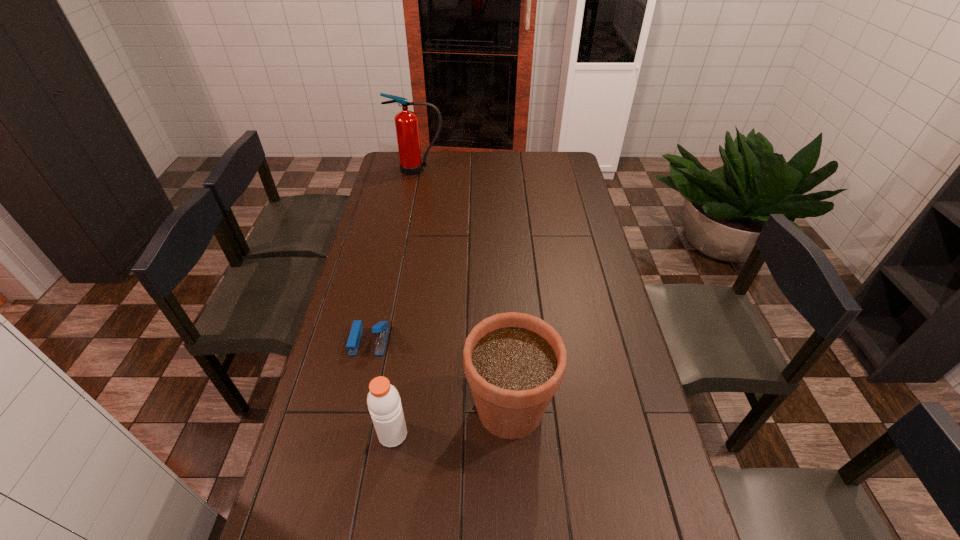
The image size is (960, 540). I want to click on vacant space that's between the second farthest object and the rightmost object, so click(440, 375).

Locate an element on the screen. The height and width of the screenshot is (540, 960). free spot between the shaker and the farthest object is located at coordinates (405, 302).

You are a GUI agent. You are given a task and a screenshot of the screen. Output one action in this format:
    pyautogui.click(x=<x>, y=<y>)
    Task: Click on the free spot between the stapler and the farthest object
    
    Given the screenshot: What is the action you would take?
    pyautogui.click(x=394, y=255)

Image resolution: width=960 pixels, height=540 pixels. What are the coordinates of `vacant point located between the flowerpot and the fire extinguisher` in the screenshot? It's located at (464, 289).

I want to click on empty space that is in between the shaker and the fire extinguisher, so click(x=405, y=302).

The width and height of the screenshot is (960, 540). I want to click on empty space that is in between the shortest object and the fire extinguisher, so click(394, 255).

This screenshot has height=540, width=960. I want to click on free area in between the tallest object and the shortest object, so click(394, 255).

Where is `the third closest object to the rightmost object`? The height and width of the screenshot is (540, 960). the third closest object to the rightmost object is located at coordinates (406, 122).

I want to click on object that is the third nearest to the third nearest object, so click(406, 122).

At what (x,y) coordinates should I click in order to perform the action: click on vacant space that satisfies the following two spatial constraints: 1. on the back side of the fire extinguisher; 2. on the left side of the shortest object. Please return your answer as a coordinate pair (x, y). Looking at the image, I should click on pos(408,170).